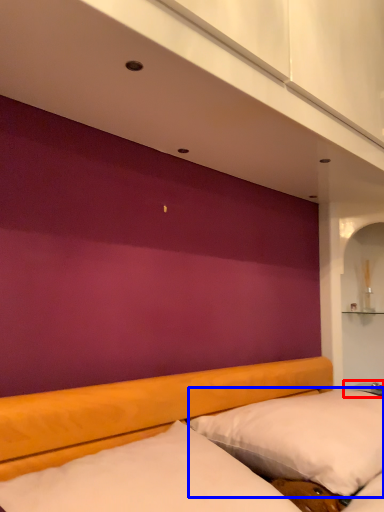
Question: Among these objects, which one is nearest to the camera, table (highlighted by a red box) or pillow (highlighted by a blue box)?

Choices:
 (A) table
 (B) pillow

Answer: (B)